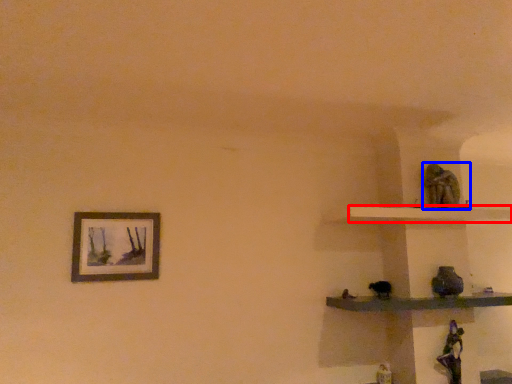
Question: Which of the following is the closest to the observer, shelf (highlighted by a red box) or statue (highlighted by a blue box)?

Choices:
 (A) shelf
 (B) statue

Answer: (A)